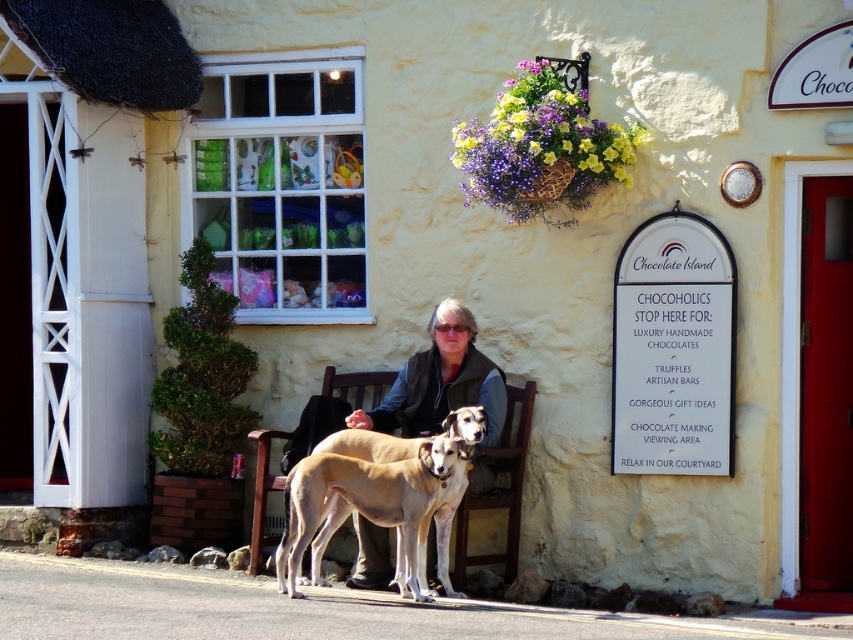
The image size is (853, 640). What do you see at coordinates (419, 483) in the screenshot?
I see `light brown fur at center` at bounding box center [419, 483].

Does light brown fur at center have a smaller size compared to brown wooden bench at center?

No, light brown fur at center is not smaller than brown wooden bench at center.

You are a GUI agent. You are given a task and a screenshot of the screen. Output one action in this format:
    pyautogui.click(x=<x>, y=<y>)
    Task: Click on the light brown fur at center
    This screenshot has width=853, height=640.
    Given the screenshot: What is the action you would take?
    pyautogui.click(x=419, y=483)

Can you confirm if matte black jacket at center is thinner than light brown fur at center?

Indeed, matte black jacket at center has a lesser width compared to light brown fur at center.

How much distance is there between matte black jacket at center and light brown fur at center?

They are 3.32 feet apart.

Locate an element on the screen. Image resolution: width=853 pixels, height=640 pixels. matte black jacket at center is located at coordinates tap(440, 381).

Can you confirm if matte black jacket at center is wider than brown wooden bench at center?

Indeed, matte black jacket at center has a greater width compared to brown wooden bench at center.

Is matte black jacket at center thinner than brown wooden bench at center?

Incorrect, matte black jacket at center's width is not less than brown wooden bench at center's.

Image resolution: width=853 pixels, height=640 pixels. What do you see at coordinates (440, 381) in the screenshot? I see `matte black jacket at center` at bounding box center [440, 381].

This screenshot has width=853, height=640. What are the coordinates of `matte black jacket at center` in the screenshot? It's located at (440, 381).